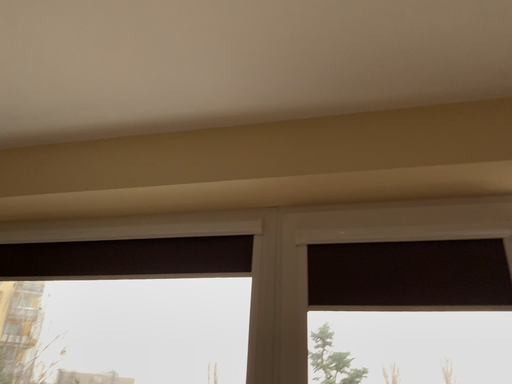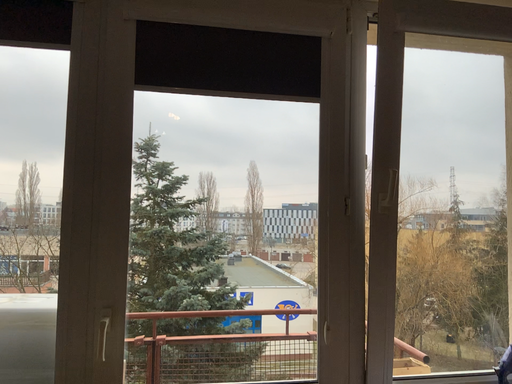
Question: Which way did the camera rotate in the video?

Choices:
 (A) rotated upward
 (B) rotated downward

Answer: (B)